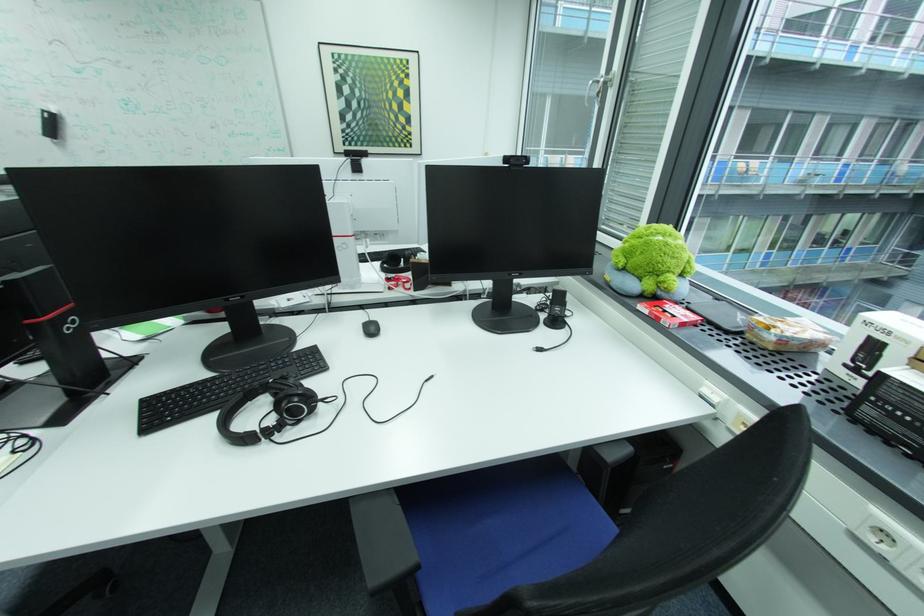
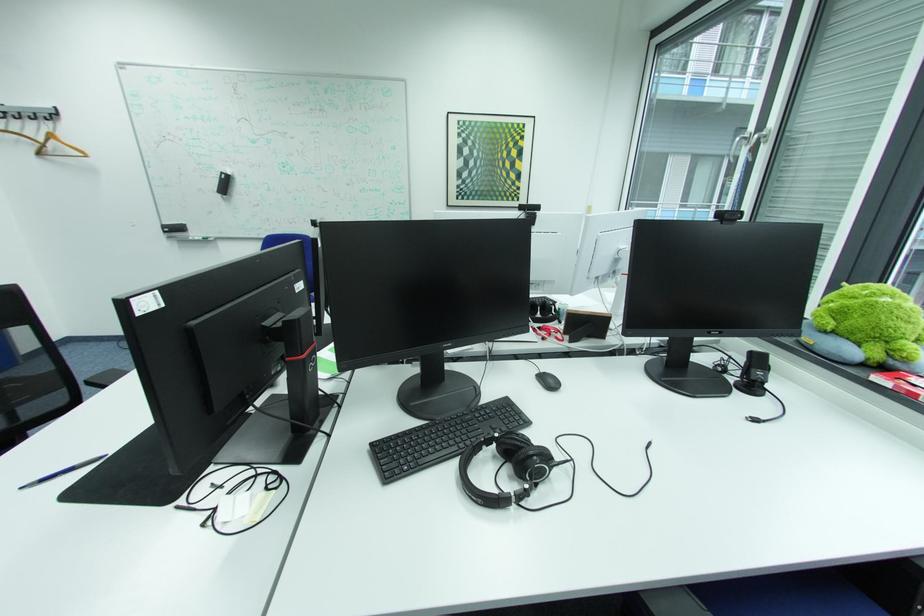
Locate, in the second image, the point that corresponds to (406,286) in the first image.

(558, 337)